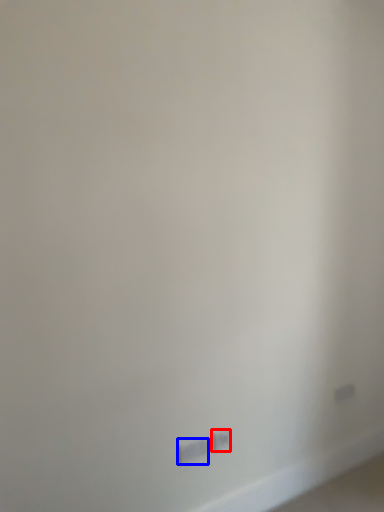
Question: Among these objects, which one is nearest to the camera, power plugs and sockets (highlighted by a red box) or power plugs and sockets (highlighted by a blue box)?

Choices:
 (A) power plugs and sockets
 (B) power plugs and sockets

Answer: (B)